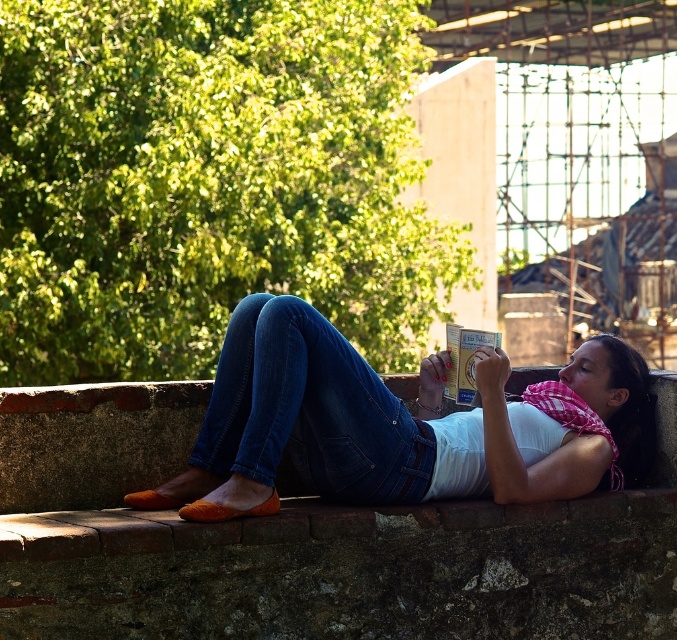
Question: Is white cotton shirt at center bigger than denim at center?

Choices:
 (A) yes
 (B) no

Answer: (A)

Question: Which point is farther to the camera?

Choices:
 (A) white cotton shirt at center
 (B) denim at center

Answer: (B)

Question: Can you confirm if white cotton shirt at center is thinner than denim at center?

Choices:
 (A) yes
 (B) no

Answer: (B)

Question: Does white cotton shirt at center appear on the left side of denim at center?

Choices:
 (A) yes
 (B) no

Answer: (B)